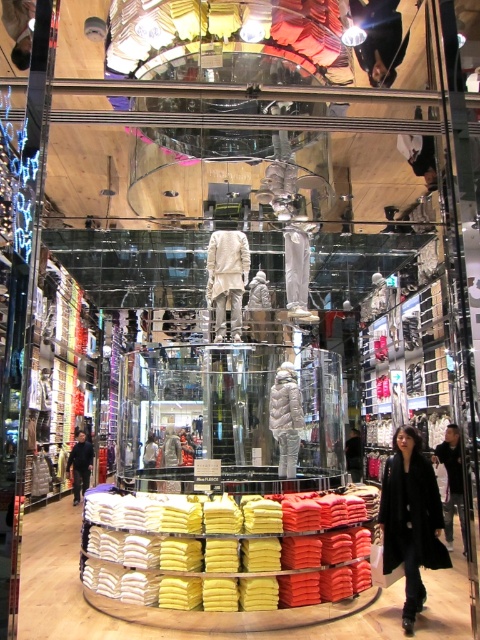
You are a customer in the store and want to compare the black wool coat at lower right and the white fur coat at center. Which one is located to the left of the other?

The black wool coat at lower right is positioned on the left side of white fur coat at center.

You are a customer in the store and want to know which coat has a wider width between the black wool coat at lower right and the white fur coat at center. Which one is wider?

The black wool coat at lower right has a larger width than the white fur coat at center according to the description.

Looking at this image, you are a customer in the store and want to pick up the black fabric jacket at lower left and the white fur coat at center. If you can carry both items at the same time, what is the minimum distance you need to walk to collect both items?

The minimum distance you need to walk to collect both items is 5.10 meters, which is the distance between the black fabric jacket at lower left and the white fur coat at center.